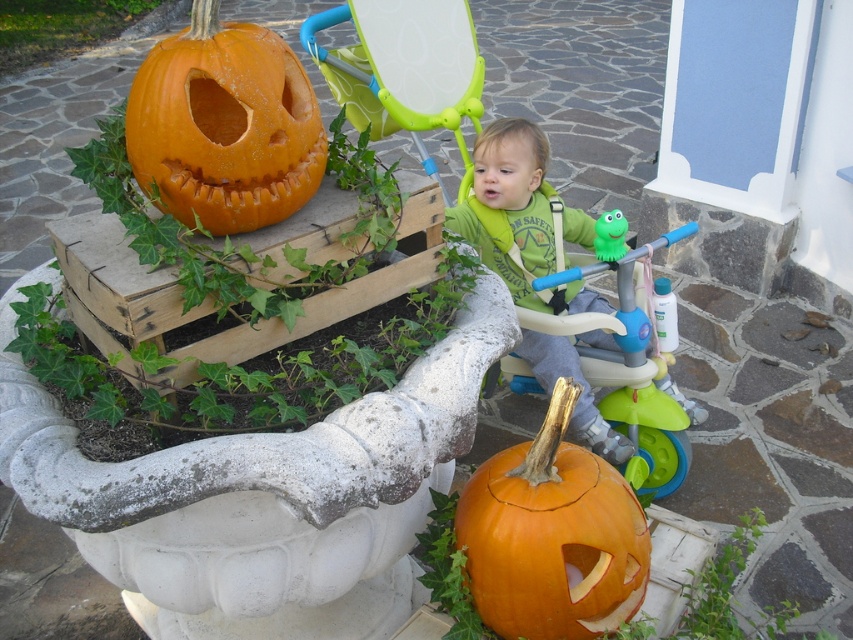
Is orange matte pumpkin at upper left to the right of green matte shirt at center from the viewer's perspective?

Incorrect, orange matte pumpkin at upper left is not on the right side of green matte shirt at center.

In the scene shown: Is orange matte pumpkin at upper left taller than green matte shirt at center?

In fact, orange matte pumpkin at upper left may be shorter than green matte shirt at center.

Locate an element on the screen. The width and height of the screenshot is (853, 640). orange matte pumpkin at upper left is located at coordinates (224, 125).

Does green plastic baby carriage at center come behind green rubber toy at center?

No, it is in front of green rubber toy at center.

Who is positioned more to the left, green plastic baby carriage at center or green rubber toy at center?

From the viewer's perspective, green plastic baby carriage at center appears more on the left side.

Who is more distant from viewer, (577, 355) or (602, 252)?

The point (577, 355) is behind.

You are a GUI agent. You are given a task and a screenshot of the screen. Output one action in this format:
    pyautogui.click(x=<x>, y=<y>)
    Task: Click on the green plastic baby carriage at center
    The image size is (853, 640).
    Given the screenshot: What is the action you would take?
    pyautogui.click(x=515, y=225)

Which is more to the left, green plastic baby carriage at center or orange matte pumpkin at lower center?

Positioned to the left is green plastic baby carriage at center.

Identify the location of green plastic baby carriage at center. (515, 225).

The height and width of the screenshot is (640, 853). Find the location of `green plastic baby carriage at center`. green plastic baby carriage at center is located at coordinates (515, 225).